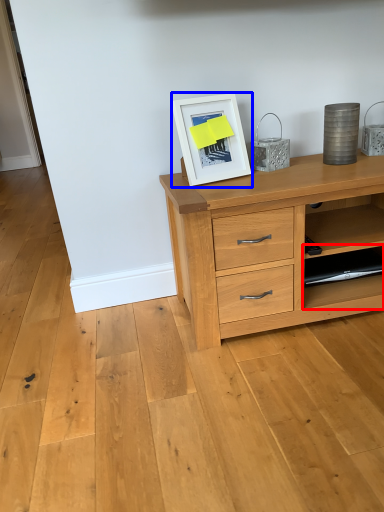
Question: Which point is further to the camera, shelf (highlighted by a red box) or picture frame (highlighted by a blue box)?

Choices:
 (A) shelf
 (B) picture frame

Answer: (A)